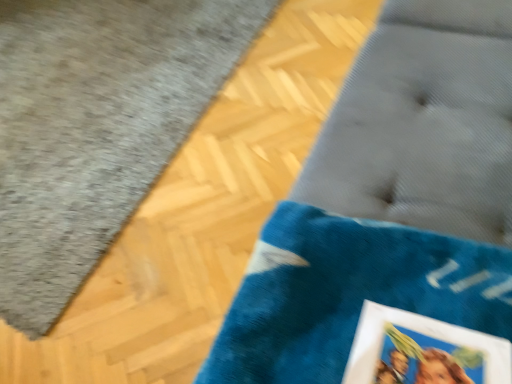
Question: Should I look upward or downward to see velvet blue cushion at lower right?

Choices:
 (A) up
 (B) down

Answer: (A)

Question: Is blue velvety bath mat at lower right far away from velvet blue cushion at lower right?

Choices:
 (A) no
 (B) yes

Answer: (B)

Question: Considering the relative sizes of blue velvety bath mat at lower right and velvet blue cushion at lower right in the image provided, is blue velvety bath mat at lower right wider than velvet blue cushion at lower right?

Choices:
 (A) yes
 (B) no

Answer: (A)

Question: From a real-world perspective, is blue velvety bath mat at lower right positioned under velvet blue cushion at lower right based on gravity?

Choices:
 (A) no
 (B) yes

Answer: (B)

Question: Considering the relative sizes of blue velvety bath mat at lower right and velvet blue cushion at lower right in the image provided, is blue velvety bath mat at lower right shorter than velvet blue cushion at lower right?

Choices:
 (A) no
 (B) yes

Answer: (B)

Question: Could you tell me if blue velvety bath mat at lower right is turned towards velvet blue cushion at lower right?

Choices:
 (A) yes
 (B) no

Answer: (A)

Question: Is blue velvety bath mat at lower right thinner than velvet blue cushion at lower right?

Choices:
 (A) yes
 (B) no

Answer: (B)

Question: Is velvet blue cushion at lower right not inside blue velvety bath mat at lower right?

Choices:
 (A) yes
 (B) no

Answer: (A)

Question: Is velvet blue cushion at lower right bigger than blue velvety bath mat at lower right?

Choices:
 (A) yes
 (B) no

Answer: (A)

Question: Does velvet blue cushion at lower right have a lesser height compared to blue velvety bath mat at lower right?

Choices:
 (A) yes
 (B) no

Answer: (B)

Question: From a real-world perspective, is velvet blue cushion at lower right on blue velvety bath mat at lower right?

Choices:
 (A) yes
 (B) no

Answer: (A)

Question: From the image's perspective, is velvet blue cushion at lower right beneath blue velvety bath mat at lower right?

Choices:
 (A) yes
 (B) no

Answer: (A)

Question: Is blue velvety bath mat at lower right a part of velvet blue cushion at lower right?

Choices:
 (A) yes
 (B) no

Answer: (B)

Question: From the image's perspective, is velvet blue cushion at lower right located above or below blue velvety bath mat at lower right?

Choices:
 (A) below
 (B) above

Answer: (A)